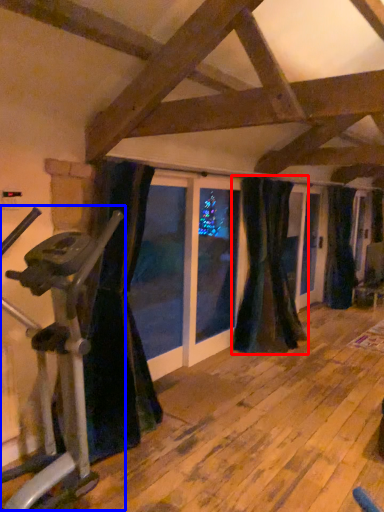
Question: Among these objects, which one is farthest to the camera, curtain (highlighted by a red box) or stationary bicycle (highlighted by a blue box)?

Choices:
 (A) curtain
 (B) stationary bicycle

Answer: (A)